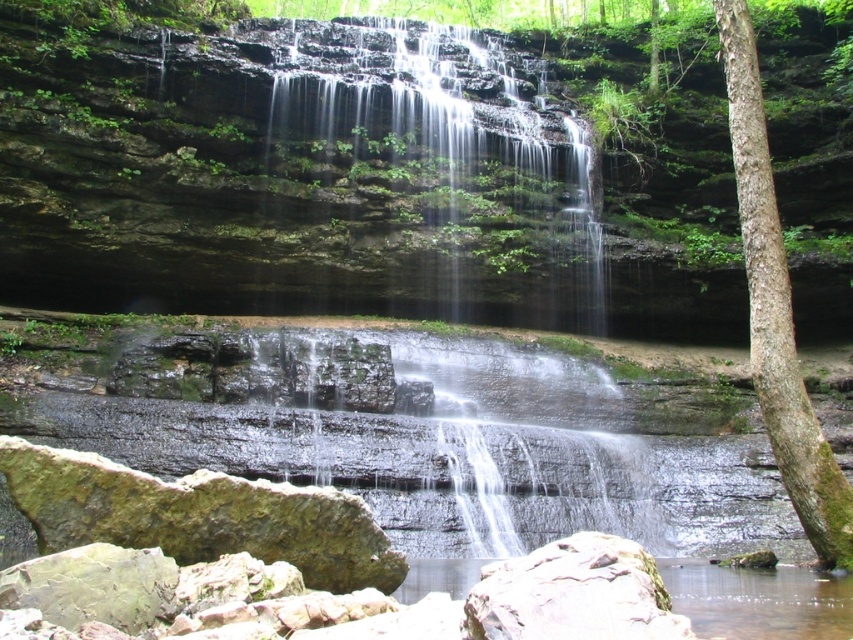
Is green rough bark tree at right in front of smooth gray rock at lower center?

No, it is not.

Does green rough bark tree at right have a lesser height compared to smooth gray rock at lower center?

Incorrect, green rough bark tree at right's height does not fall short of smooth gray rock at lower center's.

Between point (761, 328) and point (479, 627), which one is positioned behind?

Point (761, 328)

Where is `green rough bark tree at right`? Image resolution: width=853 pixels, height=640 pixels. green rough bark tree at right is located at coordinates pyautogui.click(x=776, y=308).

Which is behind, point (581, 180) or point (752, 276)?

The point (581, 180) is behind.

Locate an element on the screen. Image resolution: width=853 pixels, height=640 pixels. translucent rock waterfall at center is located at coordinates (437, 173).

Is translucent rock waterfall at center shorter than smooth gray rock at lower center?

Incorrect, translucent rock waterfall at center's height does not fall short of smooth gray rock at lower center's.

Is translucent rock waterfall at center to the right of smooth gray rock at lower center from the viewer's perspective?

Incorrect, translucent rock waterfall at center is not on the right side of smooth gray rock at lower center.

Find the location of `translucent rock waterfall at center`. translucent rock waterfall at center is located at coordinates (437, 173).